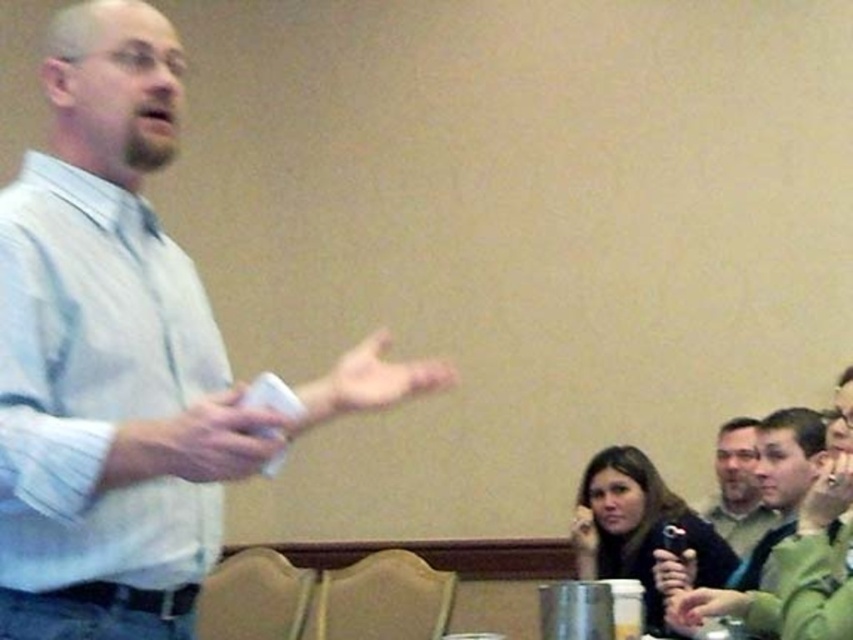
Who is taller, white shirt at left or green fabric shirt at center?

Standing taller between the two is white shirt at left.

This screenshot has width=853, height=640. In order to click on white shirt at left in this screenshot , I will do `click(125, 356)`.

Is point (4, 406) closer to camera compared to point (747, 529)?

Yes, point (4, 406) is closer to viewer.

Locate an element on the screen. white shirt at left is located at coordinates (125, 356).